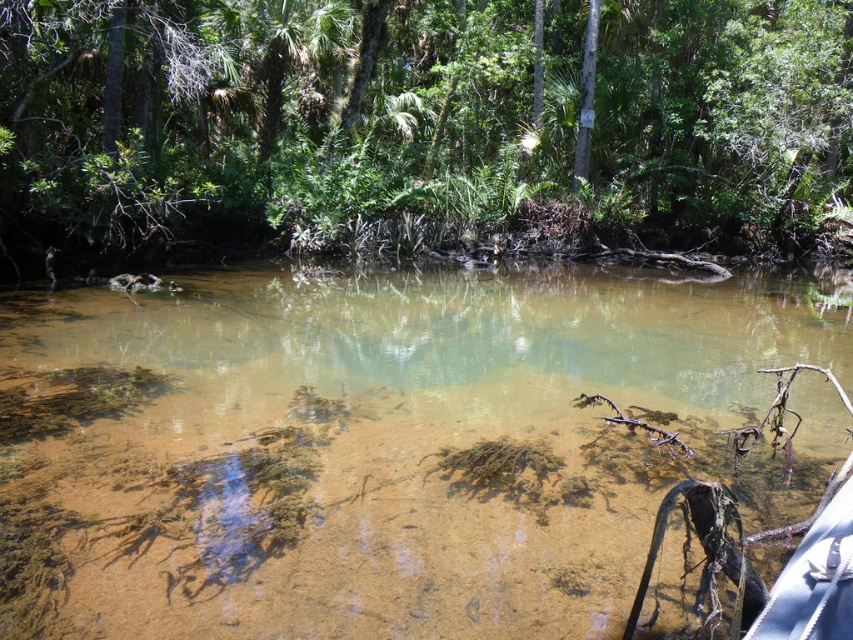
You are standing on the bank of the clear sediment river at center and want to reach the green leafy tree at upper center. Which direction should you walk to get closer to the tree?

To reach the green leafy tree at upper center from the clear sediment river at center, you should walk towards the upper direction since the tree is positioned above the river in the image.

You are a kayaker planning to navigate through the clear sediment river at center and the green leafy tree at upper center. Which path would you choose to ensure your kayak fits through? Explain your reasoning based on the scene description.

The clear sediment river at center is thinner than the green leafy tree at upper center, so the kayak should choose the path under the green leafy tree at upper center since it has a wider passage.